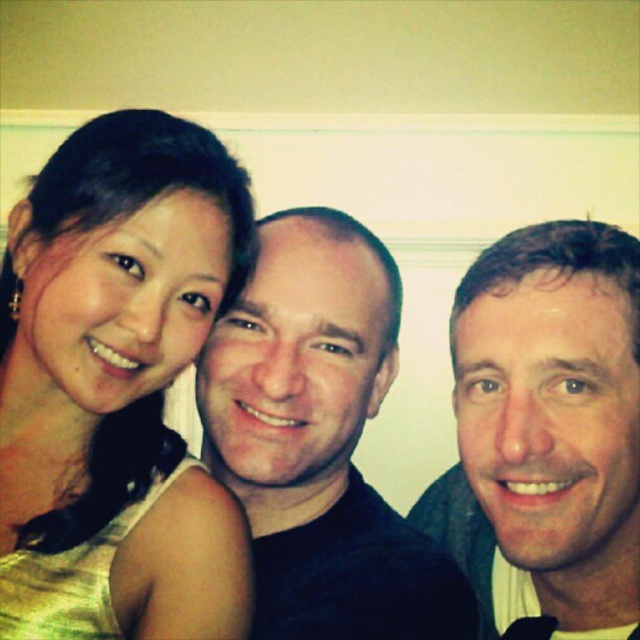
You are a photographer trying to adjust the lighting for a photo shoot. You notice the matte gold dress at left and the smooth skin face at right. Which object should you focus on first to ensure proper exposure, considering their positions?

The smooth skin face at right is behind the matte gold dress at left, so you should focus on the matte gold dress at left first to ensure proper exposure since it is closer to the camera.

You are organizing a photo shoot and need to ensure that the clothing items in the image are visible. Given that the matte gold dress at left and the matte black shirt at center are part of the outfits, which clothing item takes up more space in the photo?

The matte black shirt at center takes up more space in the photo than the matte gold dress at left because the matte gold dress at left occupies less space than the matte black shirt at center.